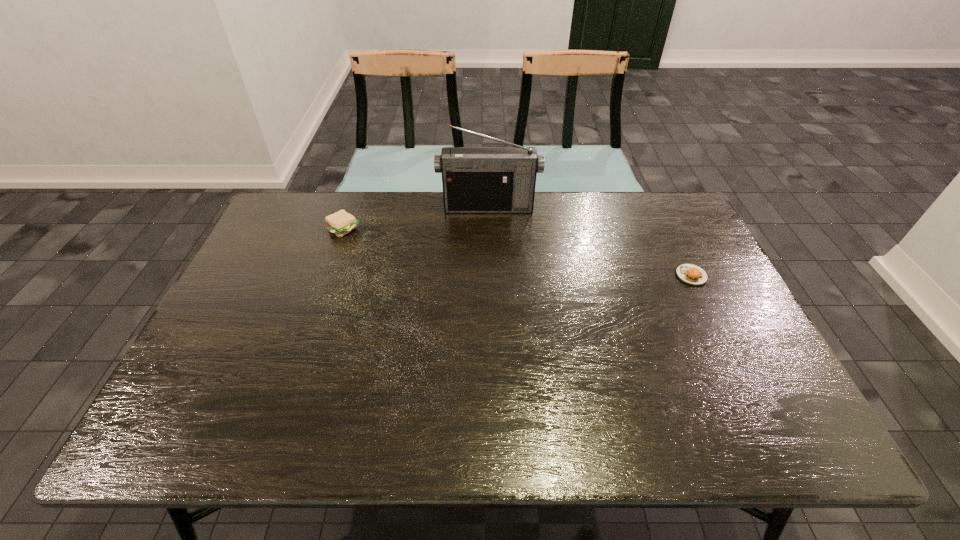
Where is `the tallest object`? Image resolution: width=960 pixels, height=540 pixels. the tallest object is located at coordinates (476, 180).

I want to click on the second object from left to right, so click(476, 180).

Locate an element on the screen. the second nearest object is located at coordinates (340, 223).

This screenshot has height=540, width=960. I want to click on the farther patty, so (x=340, y=223).

At what (x,y) coordinates should I click in order to perform the action: click on the right patty. Please return your answer as a coordinate pair (x, y). The width and height of the screenshot is (960, 540). Looking at the image, I should click on (690, 274).

You are a GUI agent. You are given a task and a screenshot of the screen. Output one action in this format:
    pyautogui.click(x=<x>, y=<y>)
    Task: Click on the nearest object
    The height and width of the screenshot is (540, 960).
    Given the screenshot: What is the action you would take?
    pyautogui.click(x=690, y=274)

I want to click on vacant space situated on the front-facing side of the tallest object, so click(x=490, y=267).

What are the coordinates of `free space located 0.060m on the left of the second tallest object` in the screenshot? It's located at (309, 229).

Where is `free spot located 0.110m on the front of the right patty`? This screenshot has width=960, height=540. free spot located 0.110m on the front of the right patty is located at coordinates (711, 318).

Image resolution: width=960 pixels, height=540 pixels. Identify the location of radio receiver that is at the far edge. (476, 180).